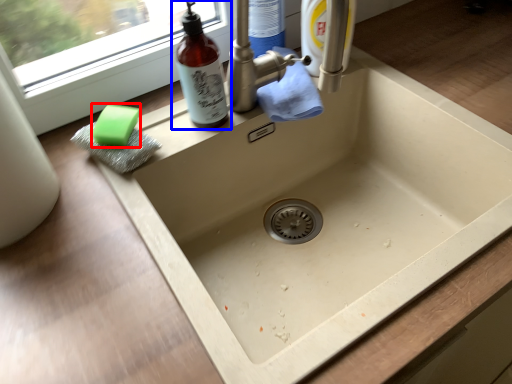
Question: Which point is closer to the camera, soap (highlighted by a red box) or bottle (highlighted by a blue box)?

Choices:
 (A) soap
 (B) bottle

Answer: (B)